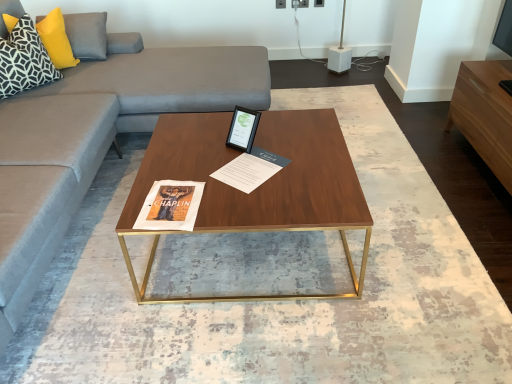
Where is `yellow fabric pillow at upper left, marked as the 2th pillow in a front-to-back arrangement`? yellow fabric pillow at upper left, marked as the 2th pillow in a front-to-back arrangement is located at coordinates (87, 35).

What is the approximate height of black and white geometric fabric pillow at upper left, the 1th pillow when ordered from front to back?

black and white geometric fabric pillow at upper left, the 1th pillow when ordered from front to back, is 15.17 inches in height.

Identify the location of light brown wood entertainment center at right. (485, 114).

Where is `matte paper magazine at center`? This screenshot has height=384, width=512. matte paper magazine at center is located at coordinates (250, 169).

This screenshot has width=512, height=384. Find the location of `matte black tablet at center`. matte black tablet at center is located at coordinates (243, 129).

Identify the location of wooden polished coffee table at center. This screenshot has height=384, width=512. (257, 188).

Locate an element on the screen. yellow fabric pillow at upper left, positioned as the first pillow in back-to-front order is located at coordinates (87, 35).

Which of these two, matte paper magazine at center or matte black tablet at center, stands shorter?

With less height is matte paper magazine at center.

What are the coordinates of `magazine in front of the matte black tablet at center` in the screenshot? It's located at (250, 169).

In the scene shown: Which object is further away from the camera, matte paper magazine at center or matte black tablet at center?

Positioned behind is matte black tablet at center.

Which object is more forward, yellow fabric pillow at upper left, marked as the 2th pillow in a front-to-back arrangement, or wooden polished coffee table at center?

Positioned in front is wooden polished coffee table at center.

From the image's perspective, would you say yellow fabric pillow at upper left, marked as the 2th pillow in a front-to-back arrangement, is positioned over wooden polished coffee table at center?

Indeed, from the image's perspective, yellow fabric pillow at upper left, marked as the 2th pillow in a front-to-back arrangement, is shown above wooden polished coffee table at center.

Where is `coffee table directly beneath the yellow fabric pillow at upper left, marked as the 2th pillow in a front-to-back arrangement (from a real-world perspective)`? coffee table directly beneath the yellow fabric pillow at upper left, marked as the 2th pillow in a front-to-back arrangement (from a real-world perspective) is located at coordinates (257, 188).

How far apart are yellow fabric pillow at upper left, marked as the 2th pillow in a front-to-back arrangement, and wooden polished coffee table at center?

yellow fabric pillow at upper left, marked as the 2th pillow in a front-to-back arrangement, is 1.53 meters away from wooden polished coffee table at center.

From the image's perspective, is light brown wood entertainment center at right on top of yellow fabric pillow at upper left, marked as the 2th pillow in a front-to-back arrangement?

Actually, light brown wood entertainment center at right appears below yellow fabric pillow at upper left, marked as the 2th pillow in a front-to-back arrangement, in the image.

At what (x,y) coordinates should I click in order to perform the action: click on entertainment center beneath the yellow fabric pillow at upper left, marked as the 2th pillow in a front-to-back arrangement (from a real-world perspective). Please return your answer as a coordinate pair (x, y). Looking at the image, I should click on (485, 114).

Considering the sizes of objects light brown wood entertainment center at right and yellow fabric pillow at upper left, positioned as the first pillow in back-to-front order, in the image provided, who is shorter, light brown wood entertainment center at right or yellow fabric pillow at upper left, positioned as the first pillow in back-to-front order,?

Standing shorter between the two is yellow fabric pillow at upper left, positioned as the first pillow in back-to-front order.

From a real-world perspective, does light brown wood entertainment center at right sit lower than yellow fabric pillow at upper left, marked as the 2th pillow in a front-to-back arrangement?

Indeed, from a real-world perspective, light brown wood entertainment center at right is positioned beneath yellow fabric pillow at upper left, marked as the 2th pillow in a front-to-back arrangement.

Who is more distant, black and white geometric fabric pillow at upper left, the 1th pillow when ordered from front to back, or matte black tablet at center?

black and white geometric fabric pillow at upper left, the 1th pillow when ordered from front to back, is more distant.

Which is closer to the camera, (29, 85) or (233, 141)?

Clearly, point (29, 85) is more distant from the camera than point (233, 141).

Would you say black and white geometric fabric pillow at upper left, the 1th pillow when ordered from front to back, contains matte black tablet at center?

Actually, matte black tablet at center is outside black and white geometric fabric pillow at upper left, the 1th pillow when ordered from front to back.

How many degrees apart are the facing directions of black and white geometric fabric pillow at upper left, the second pillow from the back, and matte black tablet at center?

The angular difference between black and white geometric fabric pillow at upper left, the second pillow from the back, and matte black tablet at center is 78.9 degrees.

What's the angular difference between light brown wood entertainment center at right and wooden polished coffee table at center's facing directions?

Result: 179 degrees separate the facing orientations of light brown wood entertainment center at right and wooden polished coffee table at center.

Considering the points (453, 122) and (344, 245), which point is behind, point (453, 122) or point (344, 245)?

The point (453, 122) is behind.

Looking at this image, are light brown wood entertainment center at right and wooden polished coffee table at center making contact?

No, light brown wood entertainment center at right is not with wooden polished coffee table at center.

Is light brown wood entertainment center at right oriented towards wooden polished coffee table at center?

Yes, light brown wood entertainment center at right faces towards wooden polished coffee table at center.

Looking at this image, looking at the image, does black and white geometric fabric pillow at upper left, the 1th pillow when ordered from front to back, seem bigger or smaller compared to yellow fabric pillow at upper left, positioned as the first pillow in back-to-front order?

In the image, black and white geometric fabric pillow at upper left, the 1th pillow when ordered from front to back, appears to be larger than yellow fabric pillow at upper left, positioned as the first pillow in back-to-front order.

What's the angular difference between black and white geometric fabric pillow at upper left, the 1th pillow when ordered from front to back, and yellow fabric pillow at upper left, marked as the 2th pillow in a front-to-back arrangement,'s facing directions?

black and white geometric fabric pillow at upper left, the 1th pillow when ordered from front to back, and yellow fabric pillow at upper left, marked as the 2th pillow in a front-to-back arrangement, are facing 0.000567 degrees away from each other.

Is point (11, 43) farther from camera compared to point (89, 56)?

No, it is in front of (89, 56).

Would you say black and white geometric fabric pillow at upper left, the second pillow from the back, is inside or outside yellow fabric pillow at upper left, marked as the 2th pillow in a front-to-back arrangement?

black and white geometric fabric pillow at upper left, the second pillow from the back, exists outside the volume of yellow fabric pillow at upper left, marked as the 2th pillow in a front-to-back arrangement.

From a real-world perspective, starting from the matte black tablet at center, which pillow is the 2nd one vertically above it? Please provide its 2D coordinates.

[(24, 60)]

Is point (238, 124) closer or farther from the camera than point (33, 86)?

Point (238, 124) appears to be closer to the viewer than point (33, 86).

Which object is positioned more to the left, matte black tablet at center or black and white geometric fabric pillow at upper left, the 1th pillow when ordered from front to back?

black and white geometric fabric pillow at upper left, the 1th pillow when ordered from front to back.

The height and width of the screenshot is (384, 512). Find the location of `magazine below the matte black tablet at center (from the image's perspective)`. magazine below the matte black tablet at center (from the image's perspective) is located at coordinates (250, 169).

Locate an element on the screen. coffee table below the yellow fabric pillow at upper left, positioned as the first pillow in back-to-front order (from a real-world perspective) is located at coordinates (257, 188).

Which object lies further to the anchor point matte black tablet at center, light brown wood entertainment center at right or yellow fabric pillow at upper left, positioned as the first pillow in back-to-front order?

yellow fabric pillow at upper left, positioned as the first pillow in back-to-front order, is further to matte black tablet at center.

Looking at the image, which one is located closer to wooden polished coffee table at center, matte paper magazine at center or light brown wood entertainment center at right?

matte paper magazine at center is closer to wooden polished coffee table at center.

When comparing their distances from light brown wood entertainment center at right, does black and white geometric fabric pillow at upper left, the second pillow from the back, or matte paper magazine at center seem further?

black and white geometric fabric pillow at upper left, the second pillow from the back, is positioned further to the anchor light brown wood entertainment center at right.

Based on their spatial positions, is black and white geometric fabric pillow at upper left, the second pillow from the back, or matte black tablet at center closer to wooden polished coffee table at center?

matte black tablet at center lies closer to wooden polished coffee table at center than the other object.

Which object lies nearer to the anchor point light brown wood entertainment center at right, matte paper magazine at center or black and white geometric fabric pillow at upper left, the 1th pillow when ordered from front to back?

Based on the image, matte paper magazine at center appears to be nearer to light brown wood entertainment center at right.

Based on their spatial positions, is matte paper magazine at center or wooden polished coffee table at center further from black and white geometric fabric pillow at upper left, the second pillow from the back?

matte paper magazine at center lies further to black and white geometric fabric pillow at upper left, the second pillow from the back, than the other object.

Which object lies further to the anchor point matte paper magazine at center, black and white geometric fabric pillow at upper left, the 1th pillow when ordered from front to back, or wooden polished coffee table at center?

black and white geometric fabric pillow at upper left, the 1th pillow when ordered from front to back, is positioned further to the anchor matte paper magazine at center.

Based on their spatial positions, is black and white geometric fabric pillow at upper left, the 1th pillow when ordered from front to back, or yellow fabric pillow at upper left, marked as the 2th pillow in a front-to-back arrangement, further from light brown wood entertainment center at right?

black and white geometric fabric pillow at upper left, the 1th pillow when ordered from front to back, lies further to light brown wood entertainment center at right than the other object.

Locate an element on the screen. Image resolution: width=512 pixels, height=384 pixels. coffee table located between black and white geometric fabric pillow at upper left, the 1th pillow when ordered from front to back, and matte paper magazine at center in the left-right direction is located at coordinates (257, 188).

Identify the location of tablet computer between black and white geometric fabric pillow at upper left, the second pillow from the back, and light brown wood entertainment center at right, in the horizontal direction. point(243,129).

Locate an element on the screen. tablet computer located between black and white geometric fabric pillow at upper left, the 1th pillow when ordered from front to back, and wooden polished coffee table at center in the left-right direction is located at coordinates (243, 129).

This screenshot has width=512, height=384. Find the location of `tablet computer between yellow fabric pillow at upper left, positioned as the first pillow in back-to-front order, and light brown wood entertainment center at right from left to right`. tablet computer between yellow fabric pillow at upper left, positioned as the first pillow in back-to-front order, and light brown wood entertainment center at right from left to right is located at coordinates (243, 129).